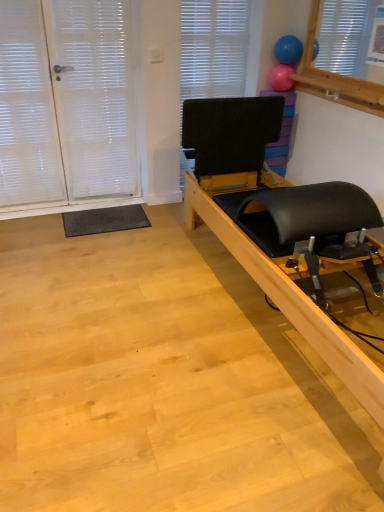
Describe the element at coordinates (280, 225) in the screenshot. I see `black leather pilates reformer at right` at that location.

From the picture: What is the approximate height of black matte blind at upper center?

It is 4.30 feet.

Locate an element on the screen. Image resolution: width=384 pixels, height=512 pixels. black matte blind at upper center is located at coordinates (213, 48).

You are a GUI agent. You are given a task and a screenshot of the screen. Output one action in this format:
    pyautogui.click(x=<x>, y=<y>)
    Task: Click on the black leather pilates reformer at right
    
    Given the screenshot: What is the action you would take?
    coord(280,225)

Between point (99, 198) and point (270, 85), which one is positioned behind?

The point (99, 198) is behind.

Is white textured screen door at left next to pink rubber balloon at upper center, acting as the 1th balloon starting from the bottom?

No, white textured screen door at left is not with pink rubber balloon at upper center, acting as the 1th balloon starting from the bottom.

Between white textured screen door at left and pink rubber balloon at upper center, acting as the 1th balloon starting from the bottom, which one has smaller width?

Thinner between the two is white textured screen door at left.

Where is `the 1st balloon above the white textured screen door at left (from a real-world perspective)`? the 1st balloon above the white textured screen door at left (from a real-world perspective) is located at coordinates (281, 78).

This screenshot has height=512, width=384. What are the coordinates of `furniture on the left of pink rubber balloon at upper center, positioned as the second balloon in top-to-bottom order` in the screenshot? It's located at (280, 225).

From a real-world perspective, which object stands above the other?

pink rubber balloon at upper center, positioned as the second balloon in top-to-bottom order, is physically above.

Is black leather pilates reformer at right bigger or smaller than pink rubber balloon at upper center, positioned as the second balloon in top-to-bottom order?

Considering their sizes, black leather pilates reformer at right takes up more space than pink rubber balloon at upper center, positioned as the second balloon in top-to-bottom order.

Is black matte blind at upper center located within blue rubber balloon at upper right, which is the first balloon from top to bottom?

No, black matte blind at upper center is not inside blue rubber balloon at upper right, which is the first balloon from top to bottom.

Are blue rubber balloon at upper right, which is the first balloon from top to bottom, and black matte blind at upper center beside each other?

They are not placed beside each other.

Between blue rubber balloon at upper right, the 2th balloon in the bottom-to-top sequence, and black matte blind at upper center, which one is positioned behind?

black matte blind at upper center.

Consider the image. From a real-world perspective, between blue rubber balloon at upper right, which is the first balloon from top to bottom, and black matte blind at upper center, who is vertically lower?

black matte blind at upper center, from a real-world perspective.

Can you confirm if pink rubber balloon at upper center, acting as the 1th balloon starting from the bottom, is shorter than black leather pilates reformer at right?

Yes.

In the scene shown: Considering the sizes of pink rubber balloon at upper center, positioned as the second balloon in top-to-bottom order, and black leather pilates reformer at right in the image, is pink rubber balloon at upper center, positioned as the second balloon in top-to-bottom order, wider or thinner than black leather pilates reformer at right?

pink rubber balloon at upper center, positioned as the second balloon in top-to-bottom order, is thinner than black leather pilates reformer at right.

From the image's perspective, is pink rubber balloon at upper center, positioned as the second balloon in top-to-bottom order, over black leather pilates reformer at right?

Yes, from the image's perspective, pink rubber balloon at upper center, positioned as the second balloon in top-to-bottom order, is above black leather pilates reformer at right.

Find the location of a particular element. balloon on the right of pink rubber balloon at upper center, positioned as the second balloon in top-to-bottom order is located at coordinates (288, 50).

Does point (293, 38) lie behind point (286, 79)?

That is False.

Which object is closer to the camera taking this photo, blue rubber balloon at upper right, which is the first balloon from top to bottom, or pink rubber balloon at upper center, acting as the 1th balloon starting from the bottom?

Positioned in front is blue rubber balloon at upper right, which is the first balloon from top to bottom.

Is black leather pilates reformer at right taller or shorter than blue rubber balloon at upper right, the 2th balloon in the bottom-to-top sequence?

In the image, black leather pilates reformer at right appears to be taller than blue rubber balloon at upper right, the 2th balloon in the bottom-to-top sequence.

From a real-world perspective, is black leather pilates reformer at right on top of blue rubber balloon at upper right, which is the first balloon from top to bottom?

No, from a real-world perspective, black leather pilates reformer at right is not on top of blue rubber balloon at upper right, which is the first balloon from top to bottom.

From the image's perspective, would you say black leather pilates reformer at right is positioned over blue rubber balloon at upper right, the 2th balloon in the bottom-to-top sequence?

No, from the image's perspective, black leather pilates reformer at right is not on top of blue rubber balloon at upper right, the 2th balloon in the bottom-to-top sequence.

Is black leather pilates reformer at right to the left of blue rubber balloon at upper right, which is the first balloon from top to bottom, from the viewer's perspective?

Indeed, black leather pilates reformer at right is positioned on the left side of blue rubber balloon at upper right, which is the first balloon from top to bottom.

Which object is thinner, black leather pilates reformer at right or black matte blind at upper center?

Thinner between the two is black matte blind at upper center.

Is black leather pilates reformer at right not inside black matte blind at upper center?

Absolutely, black leather pilates reformer at right is external to black matte blind at upper center.

Are black leather pilates reformer at right and black matte blind at upper center beside each other?

No, black leather pilates reformer at right is not in contact with black matte blind at upper center.

From a real-world perspective, between black leather pilates reformer at right and black matte blind at upper center, who is vertically lower?

black leather pilates reformer at right.

Where is `screen door in front of the pink rubber balloon at upper center, acting as the 1th balloon starting from the bottom`? screen door in front of the pink rubber balloon at upper center, acting as the 1th balloon starting from the bottom is located at coordinates (69, 105).

Find the location of `furniture below the pink rubber balloon at upper center, acting as the 1th balloon starting from the bottom (from the image's perspective)`. furniture below the pink rubber balloon at upper center, acting as the 1th balloon starting from the bottom (from the image's perspective) is located at coordinates (280, 225).

Looking at the image, which one is located closer to white textured screen door at left, pink rubber balloon at upper center, acting as the 1th balloon starting from the bottom, or black matte blind at upper center?

black matte blind at upper center lies closer to white textured screen door at left than the other object.

Looking at the image, which one is located closer to black leather pilates reformer at right, blue rubber balloon at upper right, the 2th balloon in the bottom-to-top sequence, or white textured screen door at left?

white textured screen door at left is closer to black leather pilates reformer at right.

From the image, which object appears to be farther from black matte blind at upper center, black leather pilates reformer at right or blue rubber balloon at upper right, the 2th balloon in the bottom-to-top sequence?

Based on the image, black leather pilates reformer at right appears to be further to black matte blind at upper center.

From the picture: From the image, which object appears to be nearer to white textured screen door at left, blue rubber balloon at upper right, the 2th balloon in the bottom-to-top sequence, or pink rubber balloon at upper center, positioned as the second balloon in top-to-bottom order?

pink rubber balloon at upper center, positioned as the second balloon in top-to-bottom order, lies closer to white textured screen door at left than the other object.

From the image, which object appears to be farther from black leather pilates reformer at right, pink rubber balloon at upper center, acting as the 1th balloon starting from the bottom, or black matte blind at upper center?

pink rubber balloon at upper center, acting as the 1th balloon starting from the bottom.

From the image, which object appears to be farther from black leather pilates reformer at right, blue rubber balloon at upper right, which is the first balloon from top to bottom, or black matte blind at upper center?

Based on the image, blue rubber balloon at upper right, which is the first balloon from top to bottom, appears to be further to black leather pilates reformer at right.

Which object lies nearer to the anchor point white textured screen door at left, blue rubber balloon at upper right, which is the first balloon from top to bottom, or black leather pilates reformer at right?

black leather pilates reformer at right lies closer to white textured screen door at left than the other object.

Looking at the image, which one is located closer to pink rubber balloon at upper center, acting as the 1th balloon starting from the bottom, blue rubber balloon at upper right, which is the first balloon from top to bottom, or black leather pilates reformer at right?

blue rubber balloon at upper right, which is the first balloon from top to bottom, lies closer to pink rubber balloon at upper center, acting as the 1th balloon starting from the bottom, than the other object.

This screenshot has width=384, height=512. Find the location of `balloon between white textured screen door at left and blue rubber balloon at upper right, the 2th balloon in the bottom-to-top sequence, in the horizontal direction`. balloon between white textured screen door at left and blue rubber balloon at upper right, the 2th balloon in the bottom-to-top sequence, in the horizontal direction is located at coordinates (281, 78).

This screenshot has width=384, height=512. Find the location of `blind situated between white textured screen door at left and pink rubber balloon at upper center, acting as the 1th balloon starting from the bottom, from left to right`. blind situated between white textured screen door at left and pink rubber balloon at upper center, acting as the 1th balloon starting from the bottom, from left to right is located at coordinates (213, 48).

Locate an element on the screen. Image resolution: width=384 pixels, height=512 pixels. screen door positioned between black leather pilates reformer at right and pink rubber balloon at upper center, acting as the 1th balloon starting from the bottom, from near to far is located at coordinates (69, 105).

Find the location of a particular element. screen door between black leather pilates reformer at right and black matte blind at upper center along the z-axis is located at coordinates (69, 105).